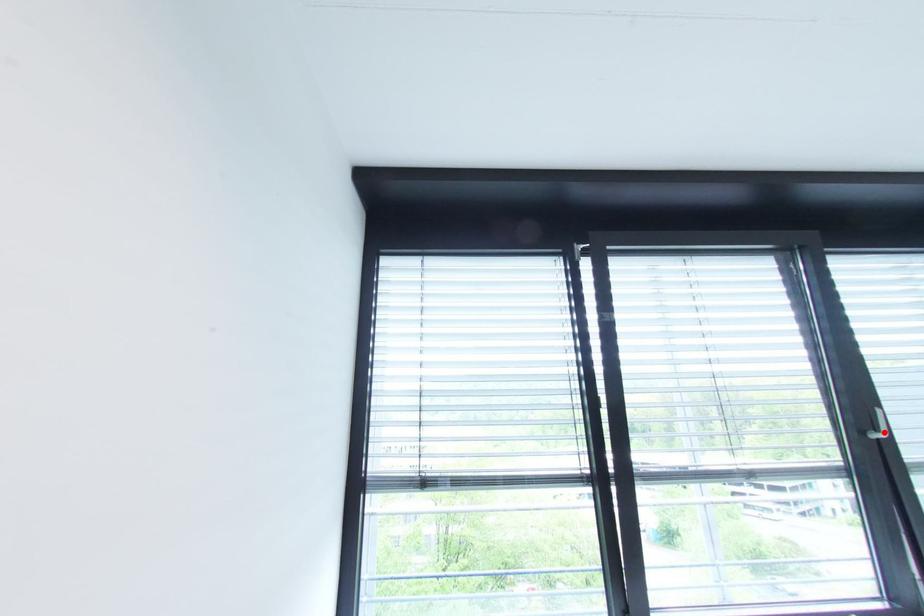
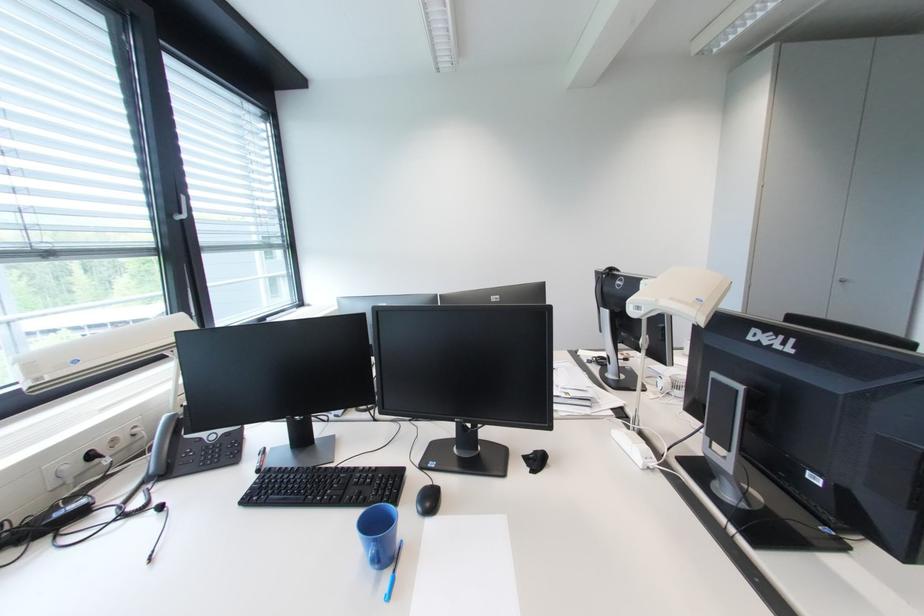
Where in the second image is the point corresponding to the highlighted location from the first image?

(188, 215)